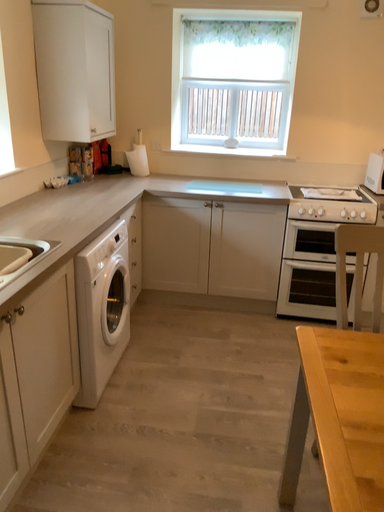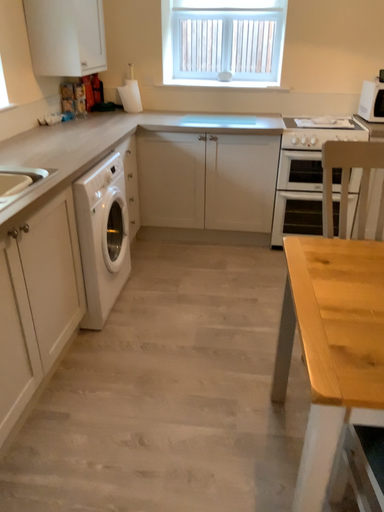
Question: Which way did the camera rotate in the video?

Choices:
 (A) rotated downward
 (B) rotated upward

Answer: (A)